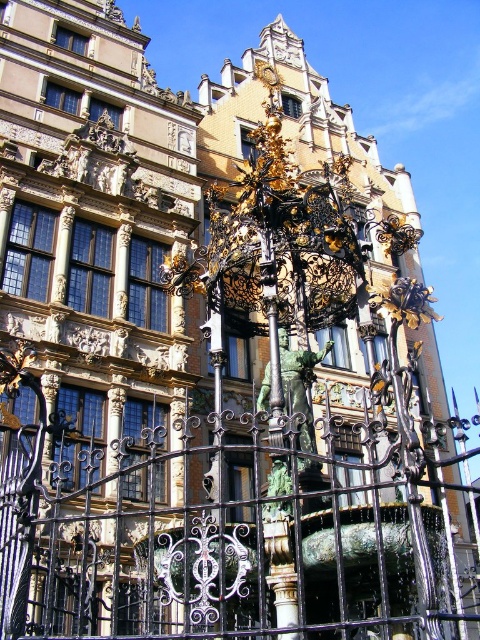
You are a tourist standing in front of the fountain and want to take a photo of the green patina statue at center without the black wrought iron fence at center appearing in the frame. Is this possible based on their positions?

The black wrought iron fence at center is below the green patina statue at center, so if you angle your camera upwards to focus on the statue, you can avoid including the fence in the photo.